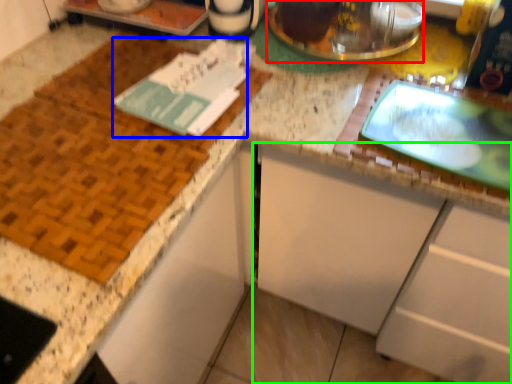
Question: Which object is positioned closest to appliance (highlighted by a red box)? Select from journal (highlighted by a blue box) and cabinetry (highlighted by a green box).

Choices:
 (A) journal
 (B) cabinetry

Answer: (A)